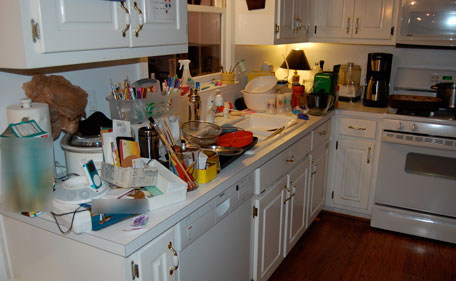
Where is `microwave`? This screenshot has height=281, width=456. microwave is located at coordinates (435, 17).